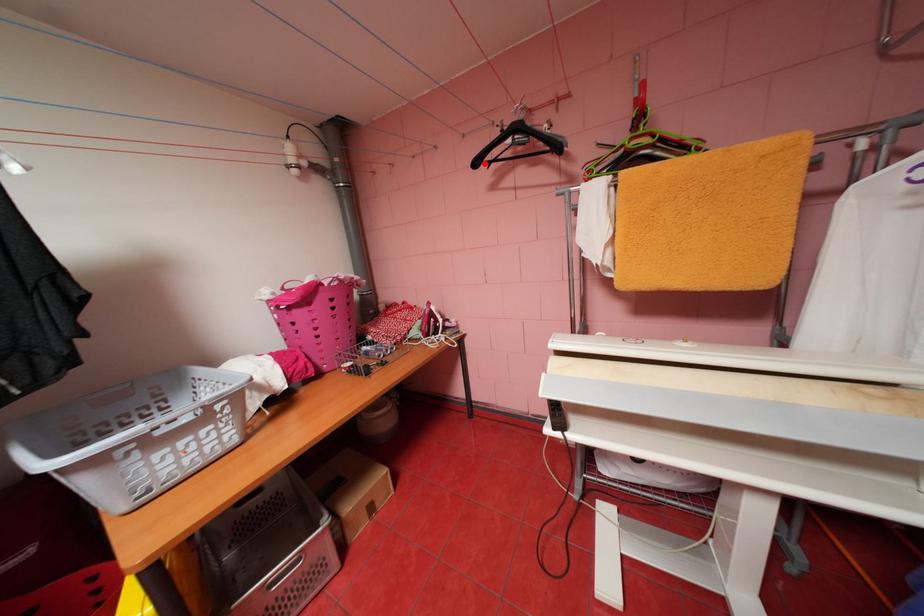
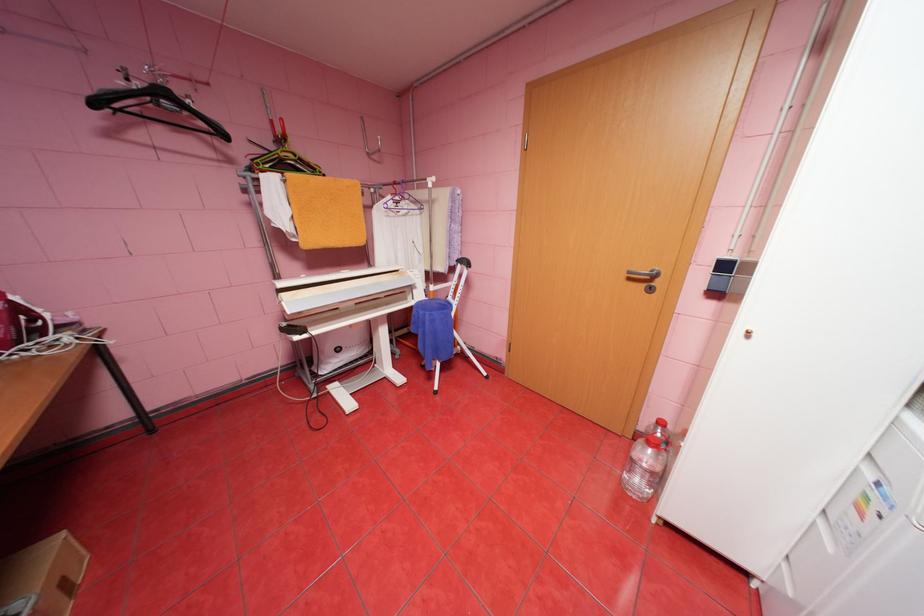
Question: I am providing you with two images of the same scene from different viewpoints. A red point is shown in image1. For the corresponding object point in image2, is it positioned nearer or farther from the camera?

Choices:
 (A) Nearer
 (B) Farther

Answer: (B)